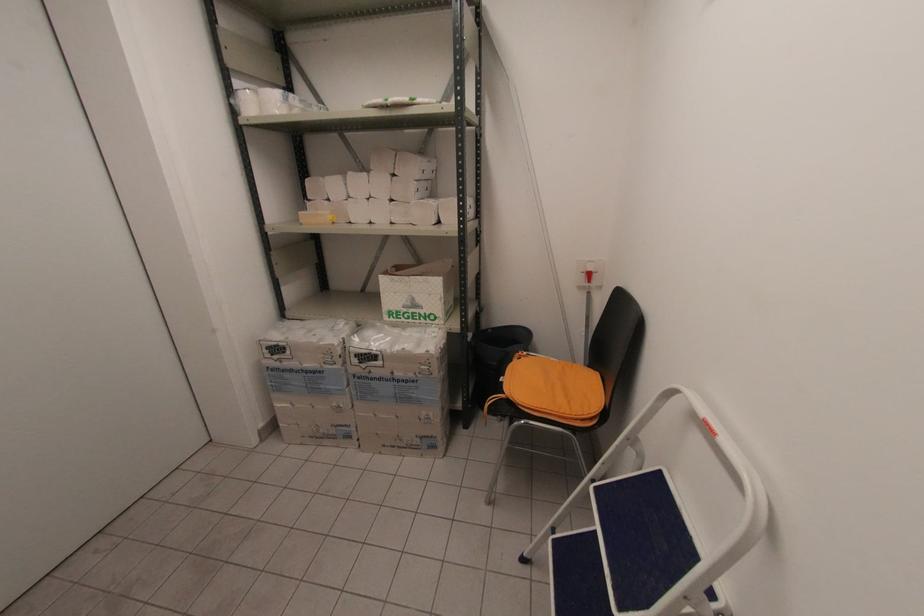
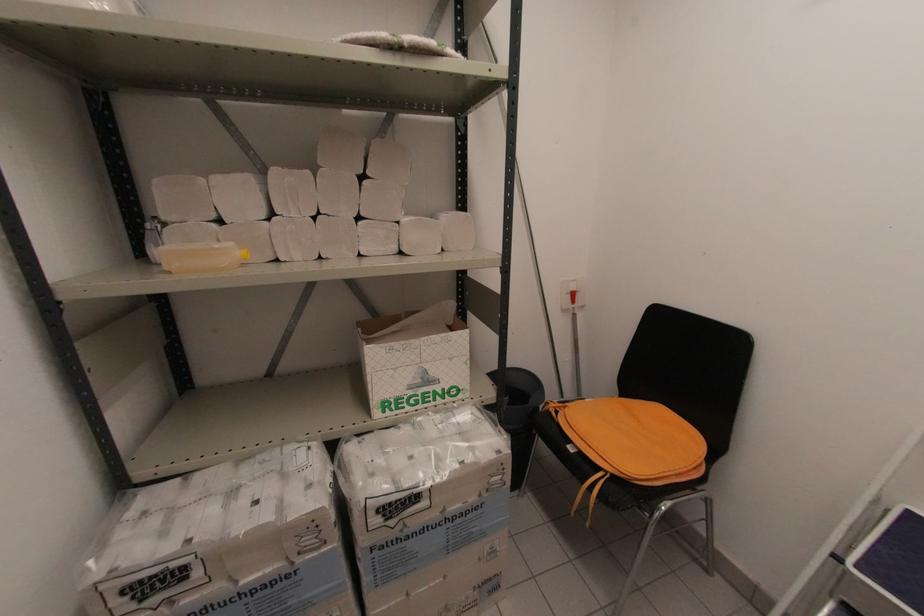
Question: The images are taken continuously from a first-person perspective. In which direction is your viewpoint rotating?

Choices:
 (A) Left
 (B) Right
 (C) Up
 (D) Down

Answer: (B)